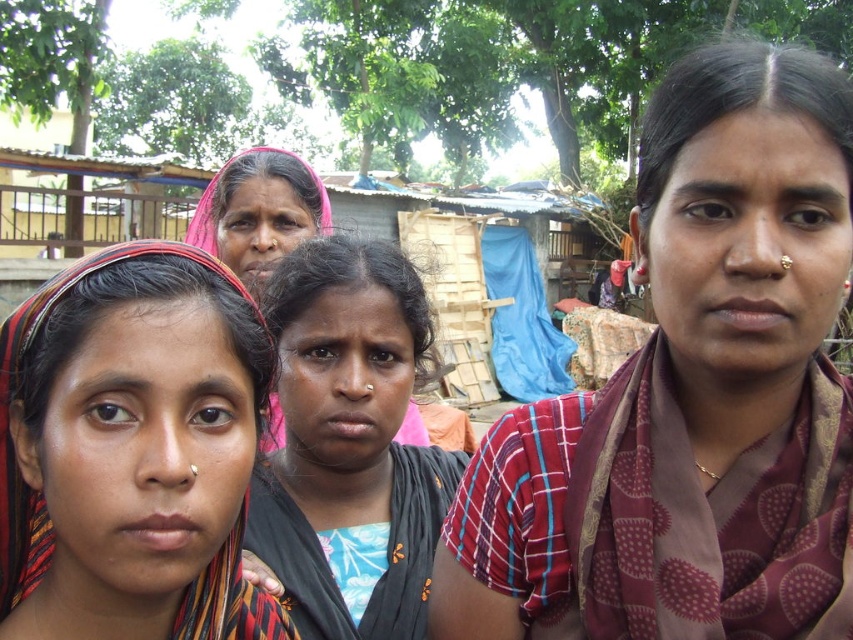
Question: Is maroon printed saree at center wider than pink fabric headscarf at center?

Choices:
 (A) yes
 (B) no

Answer: (A)

Question: Considering the real-world distances, which object is closest to the maroon printed saree at center?

Choices:
 (A) black fabric at center
 (B) multicolored fabric headscarf at left
 (C) pink fabric headscarf at center

Answer: (A)

Question: Can you confirm if black fabric at center is positioned below pink fabric headscarf at center?

Choices:
 (A) yes
 (B) no

Answer: (A)

Question: Is maroon printed saree at center smaller than black fabric at center?

Choices:
 (A) no
 (B) yes

Answer: (A)

Question: Which object is closer to the camera taking this photo?

Choices:
 (A) multicolored fabric headscarf at left
 (B) maroon printed saree at center

Answer: (A)

Question: Estimate the real-world distances between objects in this image. Which object is closer to the maroon printed saree at center?

Choices:
 (A) black fabric at center
 (B) multicolored fabric headscarf at left
 (C) pink fabric headscarf at center

Answer: (A)